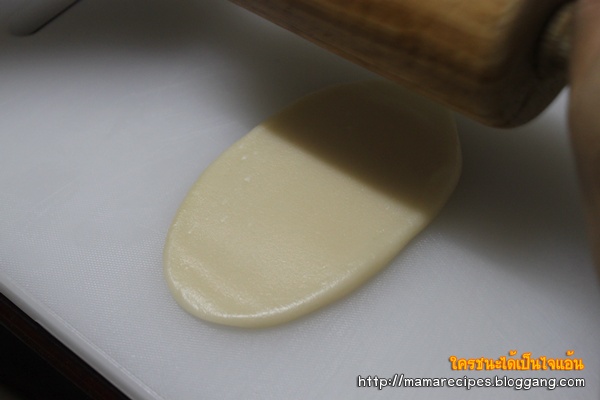
Image resolution: width=600 pixels, height=400 pixels. Identify the location of rolling pin, right side. (513, 66).